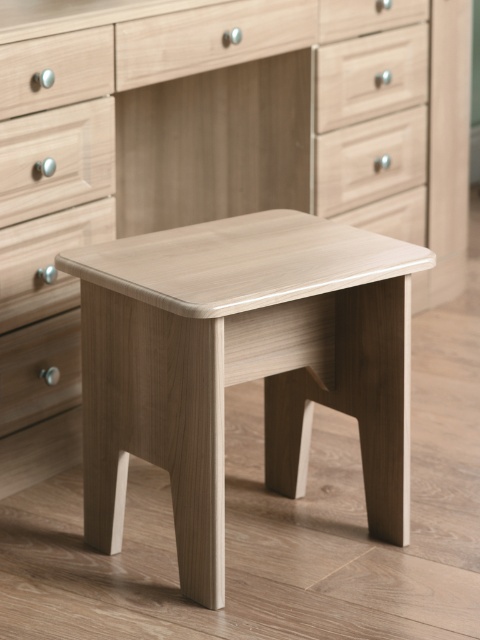
You are organizing a small toy car and need to choose between the matte wood drawer at upper right and the matte wood drawer at center. Which drawer is higher up and thus easier to reach?

The matte wood drawer at upper right is located above the matte wood drawer at center, so it is higher up and easier to reach.

You are standing in front of the minimalist wooden stool and the light colored wooden dresser. You notice two points marked in the image. The first point is at coordinate point (348, 250) and the second point is at coordinate point (20, 64). Which point is closer to you?

Point (348, 250) is closer to the viewer than point (20, 64).